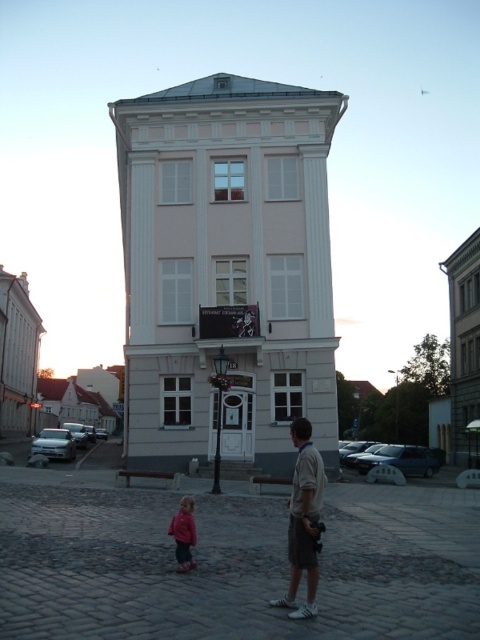
Question: Does white smooth building at center lie behind pink fleece jacket at lower center?

Choices:
 (A) yes
 (B) no

Answer: (A)

Question: Which point appears farthest from the camera in this image?

Choices:
 (A) (186, 500)
 (B) (304, 616)
 (C) (223, 195)

Answer: (C)

Question: Can you confirm if white smooth building at center is positioned to the right of pink fleece jacket at lower center?

Choices:
 (A) no
 (B) yes

Answer: (A)

Question: Does white smooth building at center appear under pink fleece jacket at lower center?

Choices:
 (A) no
 (B) yes

Answer: (A)

Question: Considering the real-world distances, which object is farthest from the light brown cotton shirt at center?

Choices:
 (A) white smooth building at center
 (B) pink fleece jacket at lower center

Answer: (A)

Question: Which of the following is the farthest from the observer?

Choices:
 (A) (215, 204)
 (B) (169, 529)
 (C) (316, 579)

Answer: (A)